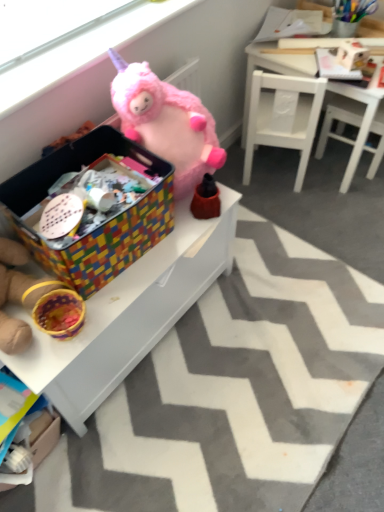
Question: From the image's perspective, relative to white wooden table at upper right, the 2th table ordered from the bottom, is cardboard box at lower left above or below?

Choices:
 (A) above
 (B) below

Answer: (B)

Question: Is cardboard box at lower left bigger or smaller than white wooden table at upper right, the 2th table ordered from the bottom?

Choices:
 (A) big
 (B) small

Answer: (B)

Question: Which is farther from the multicolored woven storage box at center?

Choices:
 (A) white matte chair at upper right
 (B) brown matte toy at center, the 2th toy when ordered from top to bottom
 (C) cardboard box at lower left
 (D) pink plush unicorn at upper center
 (E) fuzzy pink stuffed animal at upper center, the 3th toy positioned from the bottom

Answer: (A)

Question: Which object is positioned closest to the white painted wood table at center, the second table from the right?

Choices:
 (A) pink plush unicorn at upper center
 (B) white wooden table at upper right, the 2th table ordered from the bottom
 (C) multicolored woven basket at left, which is the third toy in top-to-bottom order
 (D) cardboard box at lower left
 (E) multicolored woven storage box at center

Answer: (E)